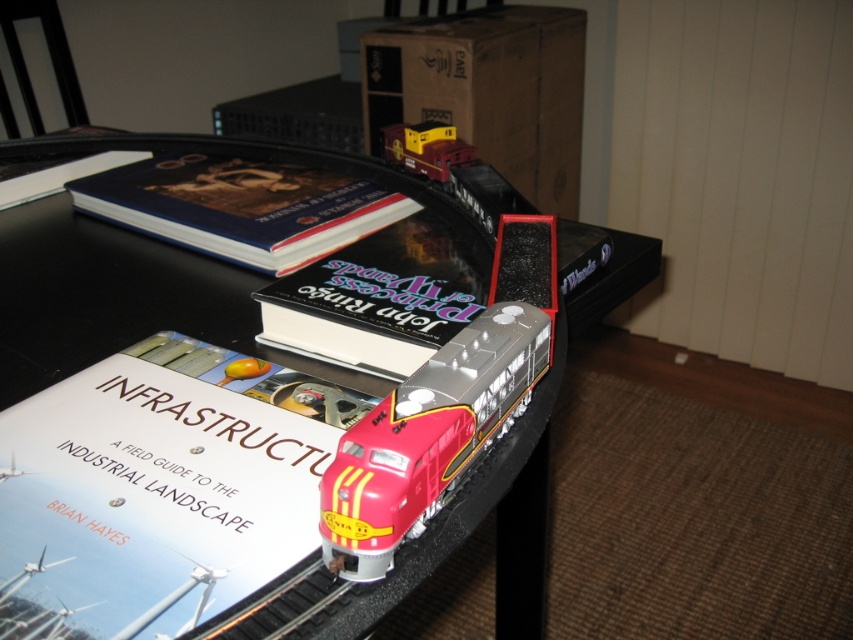
Does hardcover book at center have a lesser width compared to matte red train at center?

No.

What do you see at coordinates (376, 300) in the screenshot?
I see `hardcover book at center` at bounding box center [376, 300].

Is point (397, 266) farther from viewer compared to point (434, 147)?

No, (397, 266) is closer to viewer.

The image size is (853, 640). In order to click on hardcover book at center in this screenshot , I will do `click(376, 300)`.

Looking at this image, is hardcover book at center taller than hardcover book at upper left?

Yes.

Is point (434, 321) closer to camera compared to point (41, 163)?

Yes, point (434, 321) is closer to viewer.

The image size is (853, 640). What are the coordinates of `hardcover book at center` in the screenshot? It's located at (376, 300).

Which is behind, point (134, 598) or point (347, 269)?

The point (347, 269) is behind.

Which is in front, point (244, 490) or point (335, 326)?

Point (244, 490)

The width and height of the screenshot is (853, 640). I want to click on white paper book at center, so click(160, 488).